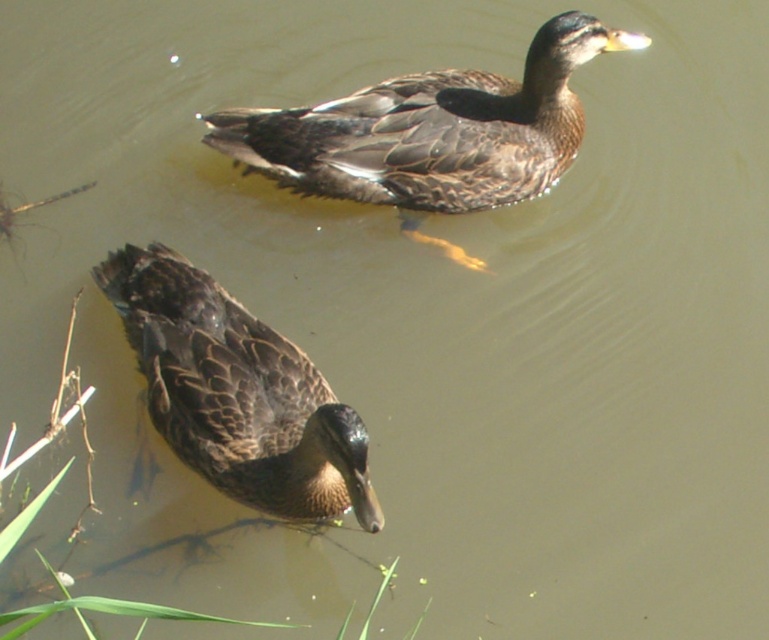
Measure the distance from brown feathered duck at upper center to dark brown feathers at lower left.

A distance of 28.52 inches exists between brown feathered duck at upper center and dark brown feathers at lower left.

Does brown feathered duck at upper center have a lesser height compared to dark brown feathers at lower left?

No, brown feathered duck at upper center is not shorter than dark brown feathers at lower left.

At what (x,y) coordinates should I click in order to perform the action: click on brown feathered duck at upper center. Please return your answer as a coordinate pair (x, y). The width and height of the screenshot is (769, 640). Looking at the image, I should click on (431, 131).